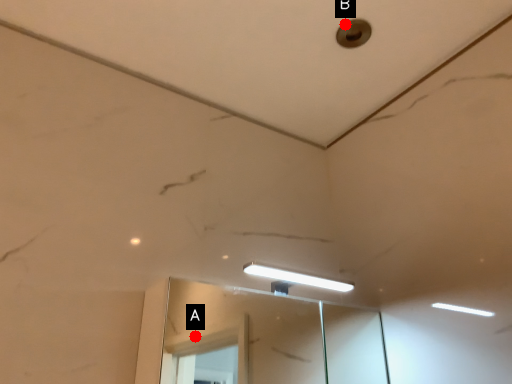
Question: Two points are circled on the image, labeled by A and B beside each circle. Which point appears closest to the camera in this image?

Choices:
 (A) A is closer
 (B) B is closer

Answer: (B)